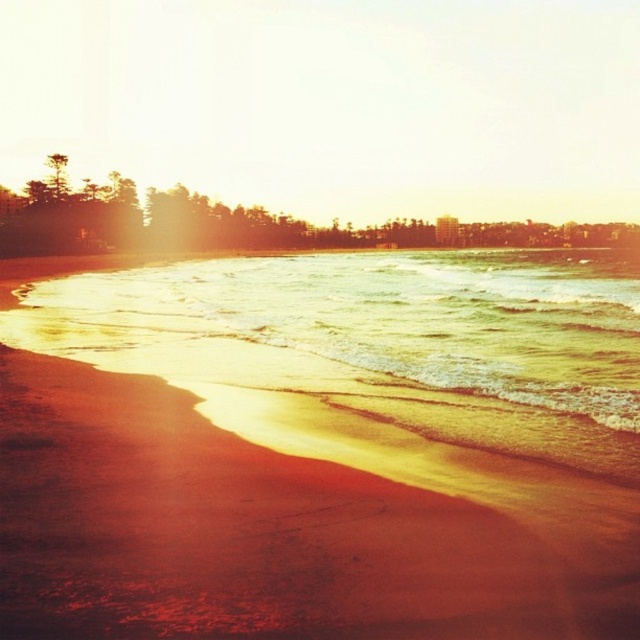
Question: Which object is closer to the camera taking this photo?

Choices:
 (A) sandy yellow water at lower left
 (B) sandy beach at lower left

Answer: (B)

Question: Is sandy beach at lower left bigger than sandy yellow water at lower left?

Choices:
 (A) no
 (B) yes

Answer: (A)

Question: Which point is farther to the camera?

Choices:
 (A) (241, 580)
 (B) (419, 424)

Answer: (B)

Question: Is sandy beach at lower left below sandy yellow water at lower left?

Choices:
 (A) no
 (B) yes

Answer: (B)

Question: Is sandy beach at lower left bigger than sandy yellow water at lower left?

Choices:
 (A) no
 (B) yes

Answer: (A)

Question: Which object appears farthest from the camera in this image?

Choices:
 (A) sandy beach at lower left
 (B) sandy yellow water at lower left

Answer: (B)